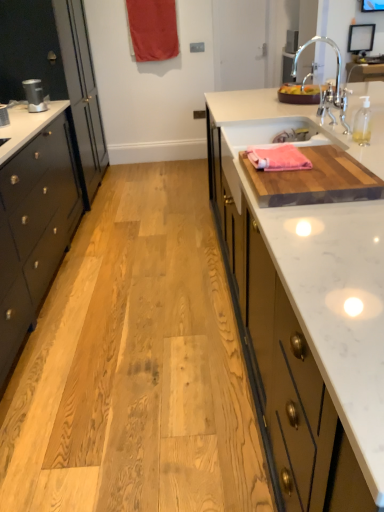
Question: Is point (334, 103) positioned closer to the camera than point (264, 147)?

Choices:
 (A) closer
 (B) farther

Answer: (B)

Question: Considering the relative positions of chrome metallic faucet at upper right and pink woven towel at upper right in the image provided, is chrome metallic faucet at upper right to the left or to the right of pink woven towel at upper right?

Choices:
 (A) left
 (B) right

Answer: (B)

Question: Which is nearer to the black glossy cabinet at left?

Choices:
 (A) red fabric curtain at upper center
 (B) pink woven towel at upper right
 (C) white marble countertop at right
 (D) white ceramic sink at upper right
 (E) matte black speaker at left

Answer: (E)

Question: Estimate the real-world distances between objects in this image. Which object is farther from the white marble countertop at right?

Choices:
 (A) matte black speaker at left
 (B) pink woven towel at upper right
 (C) black glossy cabinet at left
 (D) red fabric curtain at upper center
 (E) white ceramic sink at upper right

Answer: (D)